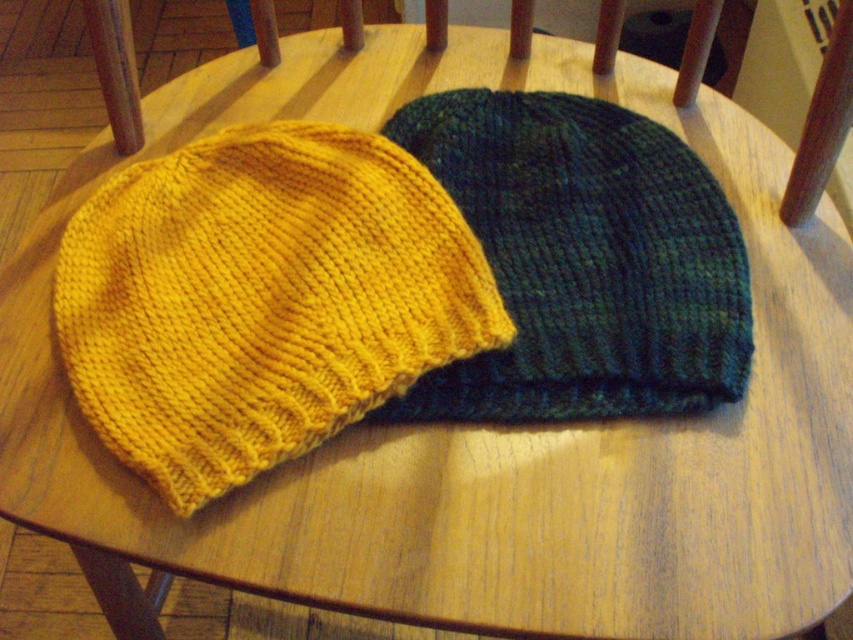
You are sitting on the wooden chair and want to pick up the yellow knitted hat at center and the dark green knitted hat at center. Which hat should you reach for first to avoid disturbing the other?

You should reach for the yellow knitted hat at center first because it is located below the dark green knitted hat at center, so picking it up first will prevent moving the upper hat.